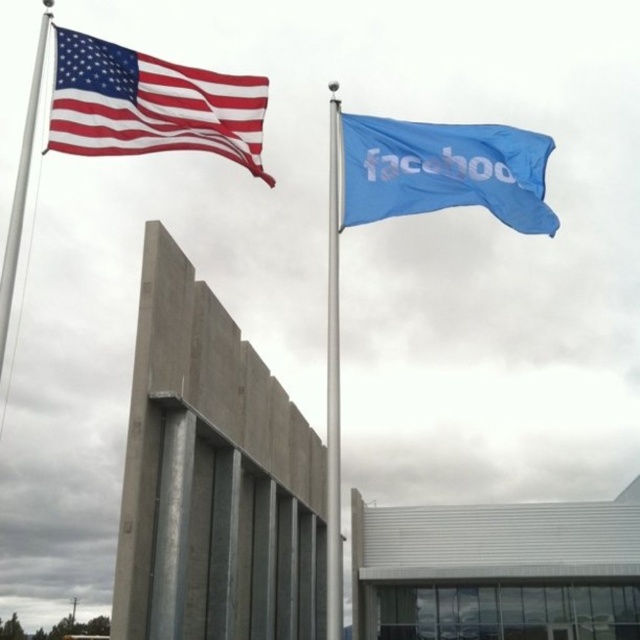
Is red-white-striped fabric flag at upper left in front of blue fabric flag at upper right?

Yes.

Which is in front, point (246, 132) or point (353, 154)?

Point (246, 132) is in front.

Is point (196, 147) positioned after point (516, 156)?

That is False.

Identify the location of red-white-striped fabric flag at upper left. The width and height of the screenshot is (640, 640). (150, 104).

This screenshot has width=640, height=640. In order to click on red-white-striped fabric flag at upper left in this screenshot , I will do `click(150, 104)`.

Between point (257, 125) and point (337, 144), which one is positioned in front?

Point (257, 125) is more forward.

You are a GUI agent. You are given a task and a screenshot of the screen. Output one action in this format:
    pyautogui.click(x=<x>, y=<y>)
    Task: Click on the red-white-striped fabric flag at upper left
    This screenshot has height=640, width=640.
    Given the screenshot: What is the action you would take?
    pyautogui.click(x=150, y=104)

Describe the element at coordinates (150, 104) in the screenshot. I see `red-white-striped fabric flag at upper left` at that location.

Which is in front, point (93, 81) or point (17, 237)?

Point (17, 237) is in front.

Image resolution: width=640 pixels, height=640 pixels. In order to click on red-white-striped fabric flag at upper left in this screenshot , I will do `click(150, 104)`.